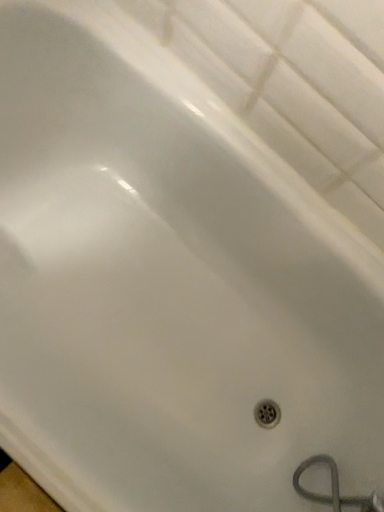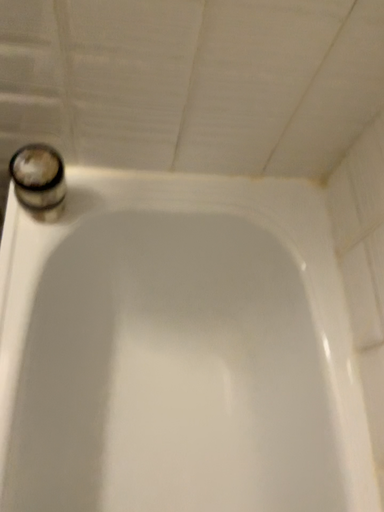
Question: How did the camera likely rotate when shooting the video?

Choices:
 (A) rotated upward
 (B) rotated downward

Answer: (A)